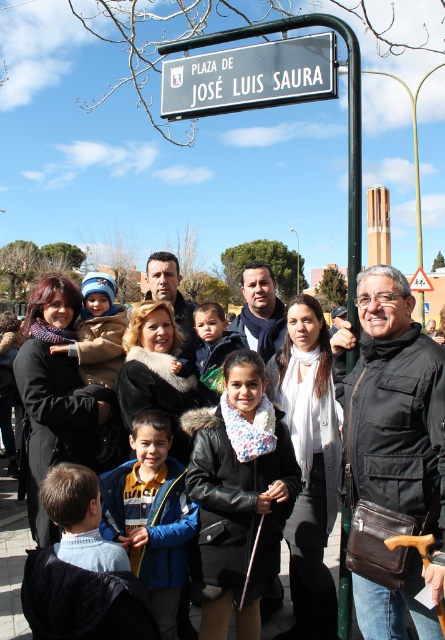
Question: Which object is the closest to the black leather jacket at center?

Choices:
 (A) light brown hair at center
 (B) blue fleece jacket at center
 (C) white plastic street sign at upper center

Answer: (B)

Question: Does black leather jacket at center have a greater width compared to light brown hair at center?

Choices:
 (A) yes
 (B) no

Answer: (A)

Question: Which object is closer to the camera taking this photo?

Choices:
 (A) dark brown leather jacket at center
 (B) blue fleece jacket at center
 (C) white plastic street sign at upper center

Answer: (A)

Question: Among these points, which one is farthest from the camera?

Choices:
 (A) (400, 314)
 (B) (133, 442)
 (C) (173, 120)

Answer: (C)

Question: Observing the image, what is the correct spatial positioning of brown leather bag at center in reference to white plastic street sign at upper center?

Choices:
 (A) right
 (B) left

Answer: (A)

Question: From the image, what is the correct spatial relationship of black leather jacket at center in relation to blue fleece jacket at center?

Choices:
 (A) below
 (B) above

Answer: (B)